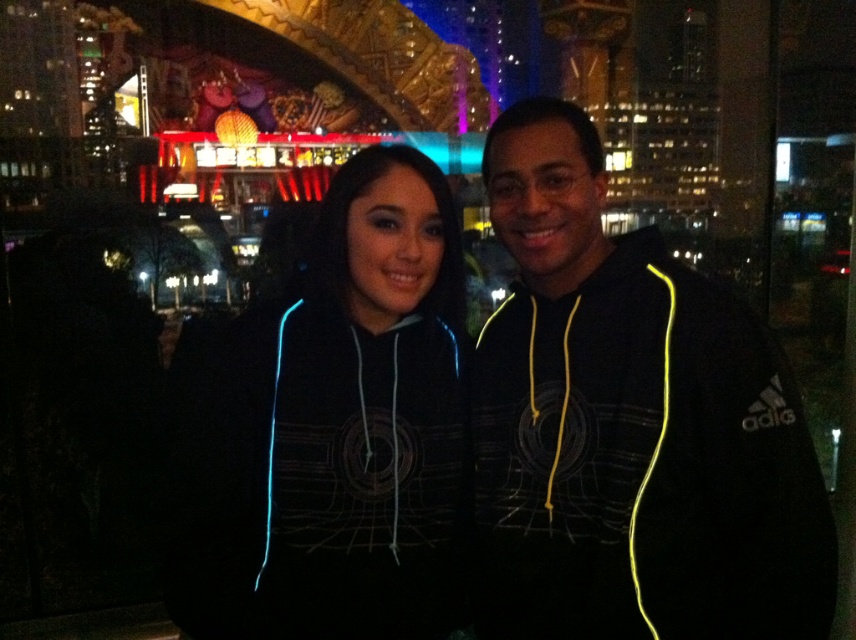
Can you confirm if black/yellow hoodie at right is positioned above black fleece hoodie at center?

Yes.

Between black/yellow hoodie at right and black fleece hoodie at center, which one appears on the right side from the viewer's perspective?

black/yellow hoodie at right

Between point (474, 460) and point (389, 609), which one is positioned in front?

Point (389, 609) is more forward.

Find the location of a particular element. The image size is (856, 640). black/yellow hoodie at right is located at coordinates (629, 426).